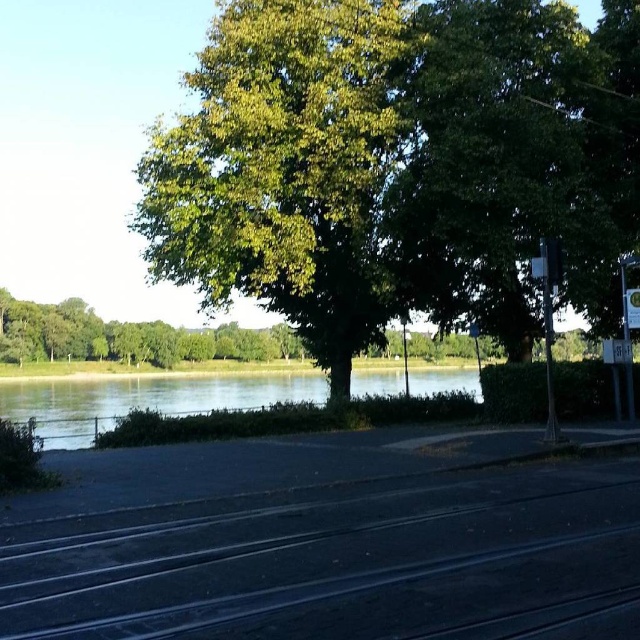
Question: Can you confirm if green leafy tree at upper center is wider than metallic silver pole at right?

Choices:
 (A) no
 (B) yes

Answer: (B)

Question: Which of the following is the closest to the observer?

Choices:
 (A) black asphalt train track at lower center
 (B) green water at lower left
 (C) green leafy tree at upper center
 (D) metallic silver pole at right

Answer: (A)

Question: Does green leafy tree at upper center appear under metallic silver pole at right?

Choices:
 (A) no
 (B) yes

Answer: (A)

Question: Among these objects, which one is nearest to the camera?

Choices:
 (A) green leafy tree at upper center
 (B) metallic silver pole at right
 (C) black asphalt train track at lower center

Answer: (C)

Question: Does green leafy tree at upper center appear on the left side of green water at lower left?

Choices:
 (A) no
 (B) yes

Answer: (A)

Question: Which object is the farthest from the green leafy tree at upper center?

Choices:
 (A) black asphalt train track at lower center
 (B) metallic silver pole at right

Answer: (A)